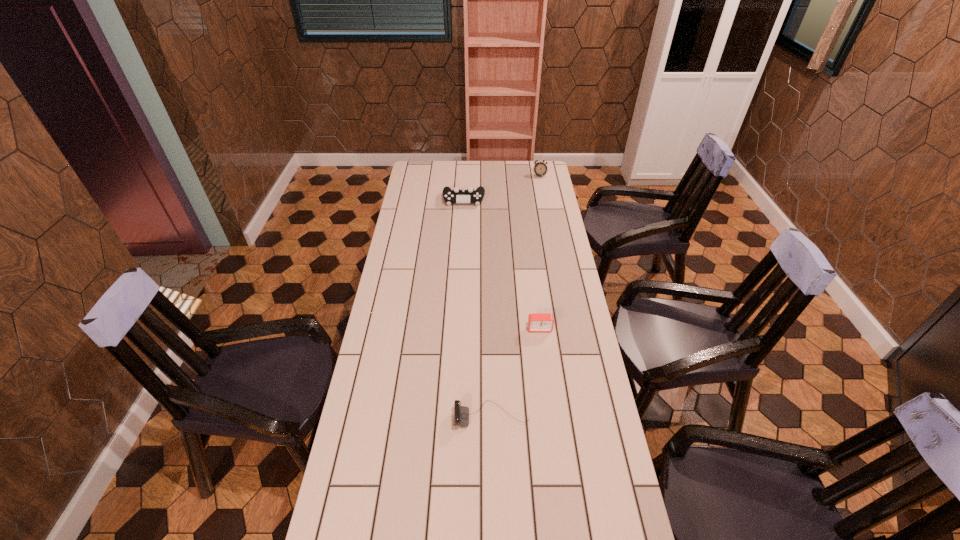
Identify the location of the tallest object. This screenshot has width=960, height=540. (540, 168).

The width and height of the screenshot is (960, 540). I want to click on the taller alarm clock, so click(540, 168).

The height and width of the screenshot is (540, 960). What are the coordinates of `control` in the screenshot? It's located at (456, 195).

The width and height of the screenshot is (960, 540). Find the location of `the left alarm clock`. the left alarm clock is located at coordinates (537, 322).

The height and width of the screenshot is (540, 960). Identify the location of the third farthest object. (537, 322).

In order to click on the shortest object in this screenshot , I will do `click(461, 413)`.

You are a GUI agent. You are given a task and a screenshot of the screen. Output one action in this format:
    pyautogui.click(x=<x>, y=<y>)
    Task: Click on the nearest object
    The image size is (960, 540).
    Given the screenshot: What is the action you would take?
    pyautogui.click(x=461, y=413)

The height and width of the screenshot is (540, 960). I want to click on vacant region located 0.260m on the face of the farthest object, so click(x=545, y=206).

Identify the location of vacant position located on the surface of the second farthest object. Image resolution: width=960 pixels, height=540 pixels. (463, 228).

What are the coordinates of `free region located on the front-facing side of the left alarm clock` in the screenshot? It's located at (549, 406).